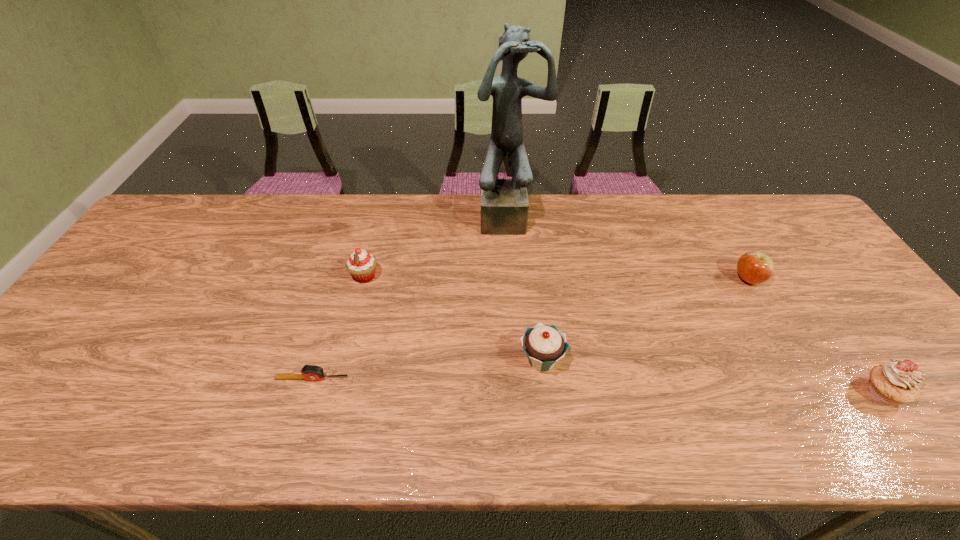
Where is `free region at the left edge`? The image size is (960, 540). free region at the left edge is located at coordinates (139, 306).

At what (x,y) coordinates should I click in order to perform the action: click on free space at the right edge of the desktop. Please return your answer as a coordinate pair (x, y). Looking at the image, I should click on (812, 268).

At what (x,y) coordinates should I click in order to perform the action: click on vacant space at the far left corner of the desktop. Please return your answer as a coordinate pair (x, y). Image resolution: width=960 pixels, height=540 pixels. Looking at the image, I should click on (180, 218).

Locate an element on the screen. This screenshot has height=540, width=960. vacant area that lies between the second cupcake from left to right and the farthest cupcake is located at coordinates (453, 319).

The image size is (960, 540). I want to click on vacant space that's between the second cupcake from left to right and the farthest cupcake, so click(x=453, y=319).

Locate an element on the screen. vacant area that lies between the rightmost cupcake and the farthest object is located at coordinates (696, 304).

What are the coordinates of `unoccupied position between the leftmost cupcake and the farthest object` in the screenshot? It's located at (437, 246).

I want to click on unoccupied area between the tape measure and the leftmost cupcake, so click(x=339, y=328).

Image resolution: width=960 pixels, height=540 pixels. In order to click on free space that is in between the second shortest object and the rightmost object in this screenshot , I will do `click(816, 336)`.

The image size is (960, 540). I want to click on unoccupied area between the rightmost cupcake and the second cupcake from left to right, so click(x=712, y=376).